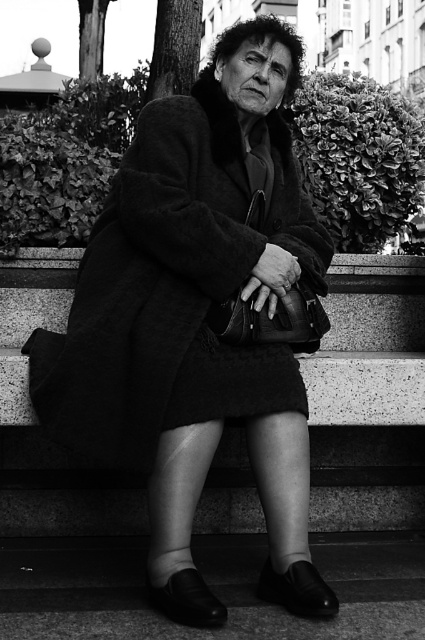
You are a photographer analyzing the composition of this black and white photo. You notice the fuzzy wool coat at center and the granite steps at center. Which object is positioned to the right in the image?

The fuzzy wool coat at center is to the right of the granite steps at center, so the fuzzy wool coat at center is positioned to the right in the image.

You are a photographer analyzing this black and white photo. You notice the fuzzy wool coat at center and the granite steps at center. Which object is closer to the camera? Please explain your reasoning based on the scene description.

The fuzzy wool coat at center is closer to the camera than the granite steps at center because the granite steps at center is described as being behind the fuzzy wool coat at center.